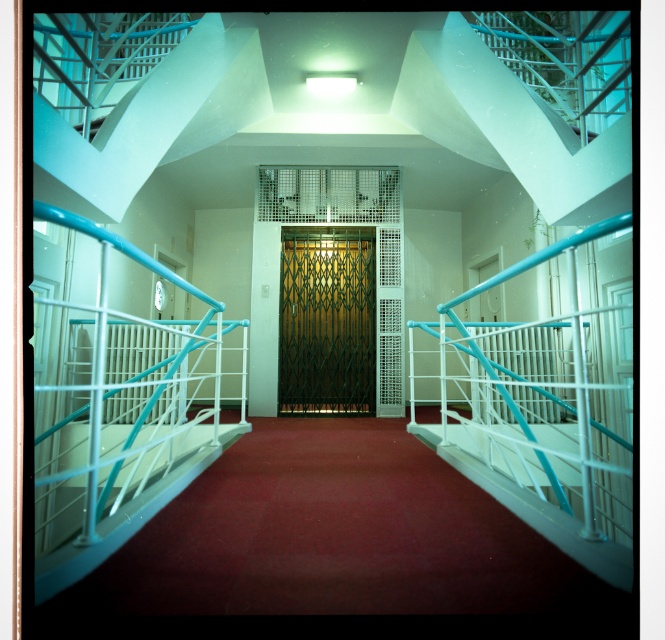
Question: Does metallic gold elevator at center have a smaller size compared to green textured door at center?

Choices:
 (A) yes
 (B) no

Answer: (A)

Question: Among these objects, which one is nearest to the camera?

Choices:
 (A) green textured door at center
 (B) metallic gold elevator at center

Answer: (B)

Question: Where is metallic gold elevator at center located in relation to green textured door at center in the image?

Choices:
 (A) below
 (B) above

Answer: (B)

Question: Which of the following is the farthest from the observer?

Choices:
 (A) green textured door at center
 (B) metallic gold elevator at center

Answer: (A)

Question: Which of the following is the closest to the observer?

Choices:
 (A) (315, 253)
 (B) (354, 168)

Answer: (B)

Question: Is metallic gold elevator at center smaller than green textured door at center?

Choices:
 (A) no
 (B) yes

Answer: (B)